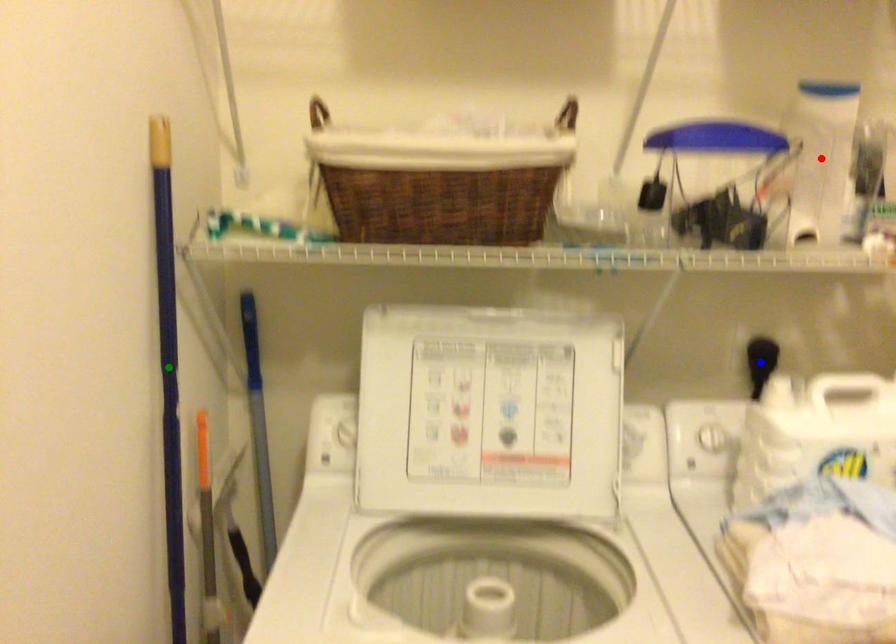
Based on the photo, order these from nearest to farthest:
- red point
- green point
- blue point

green point < red point < blue point